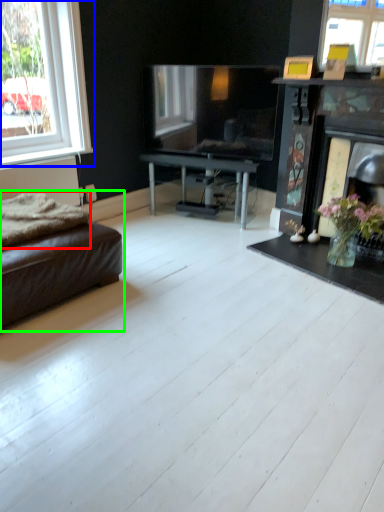
Question: Which is farther away from blanket (highlighted by a red box)? window (highlighted by a blue box) or studio couch (highlighted by a green box)?

Choices:
 (A) window
 (B) studio couch

Answer: (A)